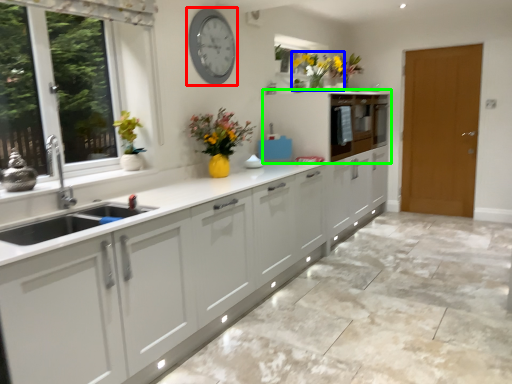
Question: Considering the real-world distances, which object is closest to clock (highlighted by a red box)? floral arrangement (highlighted by a blue box) or cabinetry (highlighted by a green box).

Choices:
 (A) floral arrangement
 (B) cabinetry

Answer: (A)